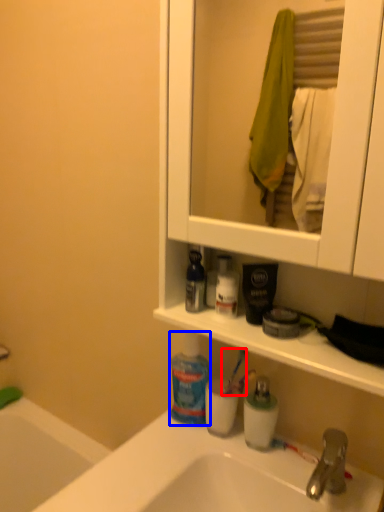
Question: Which object is further to the camera taking this photo, toothbrush (highlighted by a red box) or cleaning product (highlighted by a blue box)?

Choices:
 (A) toothbrush
 (B) cleaning product

Answer: (A)